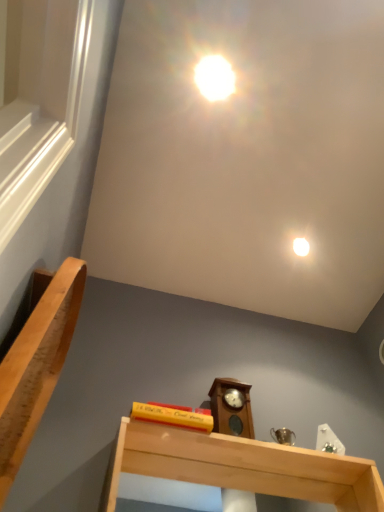
At what (x,y) coordinates should I click in order to perform the action: click on vacant point to the right of white glossy droplight at upper center. Please return your answer as a coordinate pair (x, y). Image resolution: width=384 pixels, height=512 pixels. Looking at the image, I should click on (348, 247).